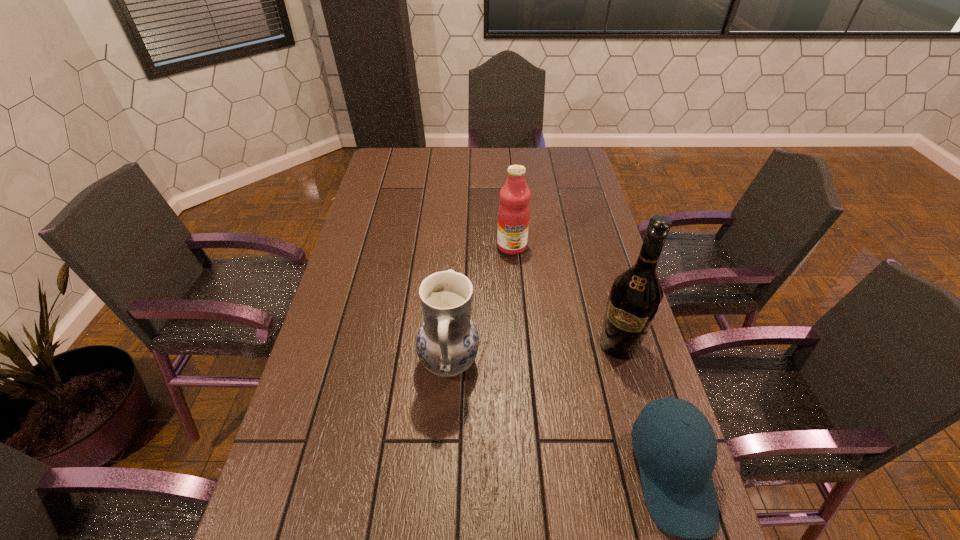
This screenshot has height=540, width=960. I want to click on vacant space on the desktop that is between the pottery and the baseball cap and is positioned on the label of the fruit juice, so click(517, 396).

Where is `vacant space on the desktop that is between the leftmost object and the nearest object and is positioned on the label of the tallest object`? The width and height of the screenshot is (960, 540). vacant space on the desktop that is between the leftmost object and the nearest object and is positioned on the label of the tallest object is located at coordinates (577, 427).